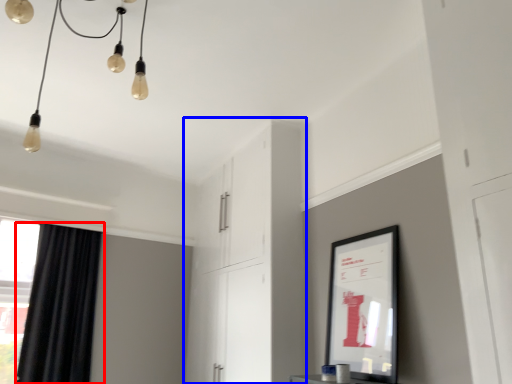
Question: Among these objects, which one is farthest to the camera, curtain (highlighted by a red box) or dresser (highlighted by a blue box)?

Choices:
 (A) curtain
 (B) dresser

Answer: (A)